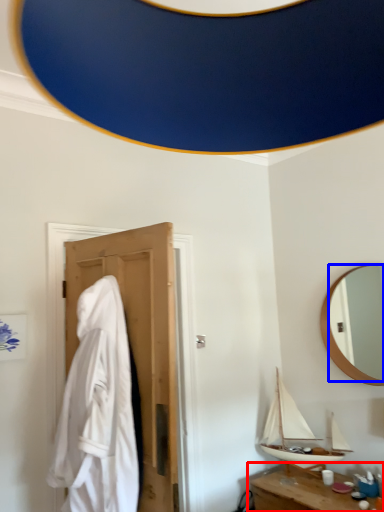
Question: Which object appears farthest to the camera in this image, table (highlighted by a red box) or mirror (highlighted by a blue box)?

Choices:
 (A) table
 (B) mirror

Answer: (B)